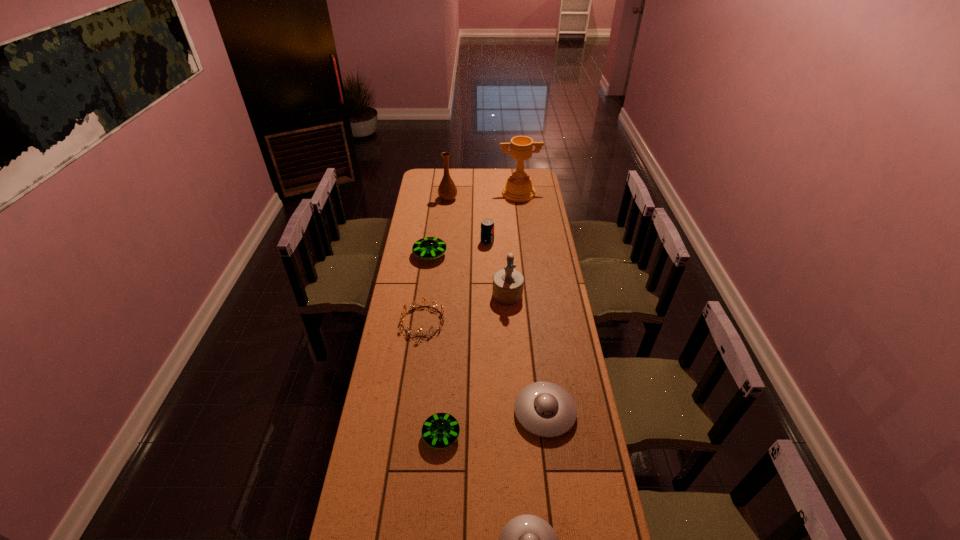
Find the location of a particular element. The height and width of the screenshot is (540, 960). the nearer green saucer is located at coordinates (441, 430).

Image resolution: width=960 pixels, height=540 pixels. I want to click on tiara, so click(x=415, y=302).

Find the location of `free region located 0.110m on the back of the award`. free region located 0.110m on the back of the award is located at coordinates pos(516,177).

At what (x,y) coordinates should I click in order to perform the action: click on vacant space positioned 0.200m on the back of the second tallest object. Please return your answer as a coordinate pair (x, y). The image size is (960, 540). Looking at the image, I should click on (450, 178).

Where is `free space located at the beak of the white figurine`? This screenshot has width=960, height=540. free space located at the beak of the white figurine is located at coordinates (510, 330).

Find the location of a particular element. free space located 0.330m on the front of the blue pop is located at coordinates (489, 288).

You are a GUI agent. You are given a task and a screenshot of the screen. Output one action in this format:
    pyautogui.click(x=<x>, y=<y>)
    Task: Click on the vacant space located on the back of the tallest saucer
    The image size is (960, 540).
    Given the screenshot: What is the action you would take?
    pyautogui.click(x=436, y=211)

At what (x,y) coordinates should I click in order to perform the action: click on vacant space located 0.100m on the front of the farther gray saucer. Please return your answer as a coordinate pair (x, y). The width and height of the screenshot is (960, 540). Looking at the image, I should click on (552, 469).

Identify the location of free spot located on the right of the nearer green saucer. (540, 435).

Identify the location of vacant point located on the front-facing side of the tiara. This screenshot has width=960, height=540. (420, 348).